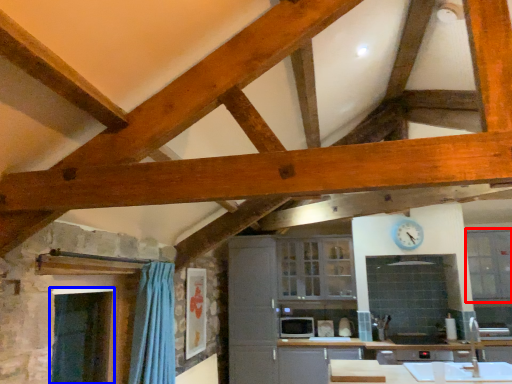
Question: Which object is closer to the camera taking this photo, window (highlighted by a red box) or window screen (highlighted by a blue box)?

Choices:
 (A) window
 (B) window screen

Answer: (B)